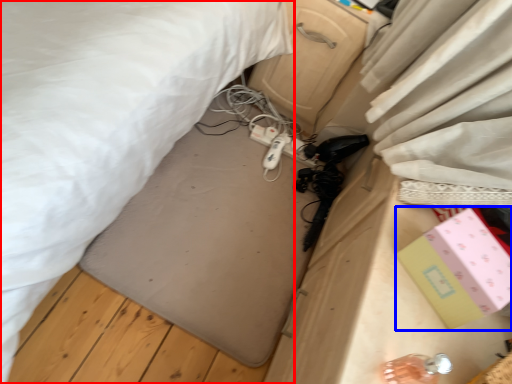
Question: Which object appears farthest to the camera in this image, bed (highlighted by a red box) or box (highlighted by a blue box)?

Choices:
 (A) bed
 (B) box

Answer: (B)